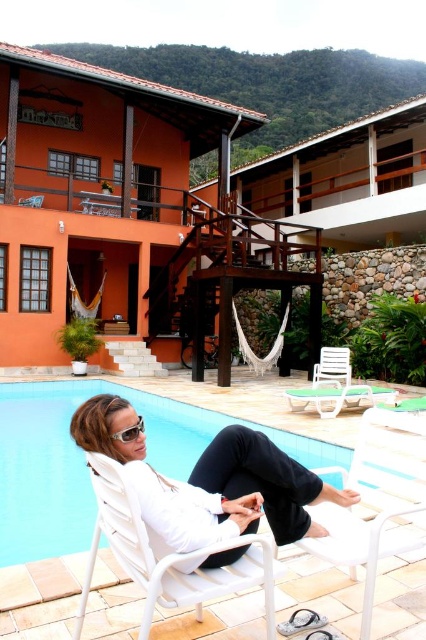
Question: Is orange wood house at upper left smaller than white plastic chair at lower right?

Choices:
 (A) no
 (B) yes

Answer: (A)

Question: Considering the real-world distances, which object is farthest from the white plastic chair at lower right?

Choices:
 (A) white plastic chair at lower center
 (B) matte white sunglasses at lower center
 (C) white plastic lounge chair at lower right
 (D) white matte chair at lower center

Answer: (C)

Question: Does orange wood house at upper left have a lesser width compared to white plastic chair at lower right?

Choices:
 (A) yes
 (B) no

Answer: (B)

Question: Estimate the real-world distances between objects in this image. Which object is closer to the white plastic chair at lower right?

Choices:
 (A) white plastic lounge chair at lower right
 (B) orange wood house at upper left
 (C) white matte chair at lower center

Answer: (C)

Question: Can you confirm if orange wood house at upper left is wider than white plastic lounge chair at lower right?

Choices:
 (A) yes
 (B) no

Answer: (A)

Question: Which of the following is the farthest from the observer?

Choices:
 (A) (170, 170)
 (B) (325, 385)
 (C) (373, 440)

Answer: (A)